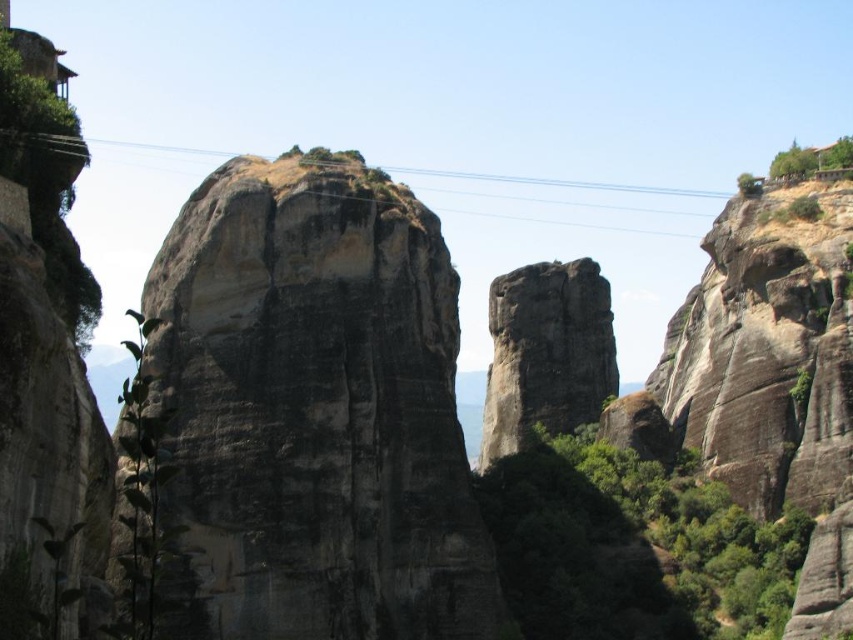
You are a geologist examining the landscape. You notice the dark gray stone rock at center and the dark gray rock formation at center. Which of these two has a greater width?

The dark gray stone rock at center has a greater width than the dark gray rock formation at center.

You are a hiker who wants to take a photo of the dark gray stone rock at center and the black wire at center. From your current position, which object should you move towards to get both in the frame?

You should move towards the black wire at center because the dark gray stone rock at center is to the right of the black wire at center, so moving towards the black wire will keep both objects within your camera frame.

You are an engineer assessing the stability of the dark gray stone rock at center and the black wire at center. Which object has a greater width, and why?

The black wire at center has a greater width than the dark gray stone rock at center because the description states that the dark gray stone rock at center is less wide than the black wire at center.